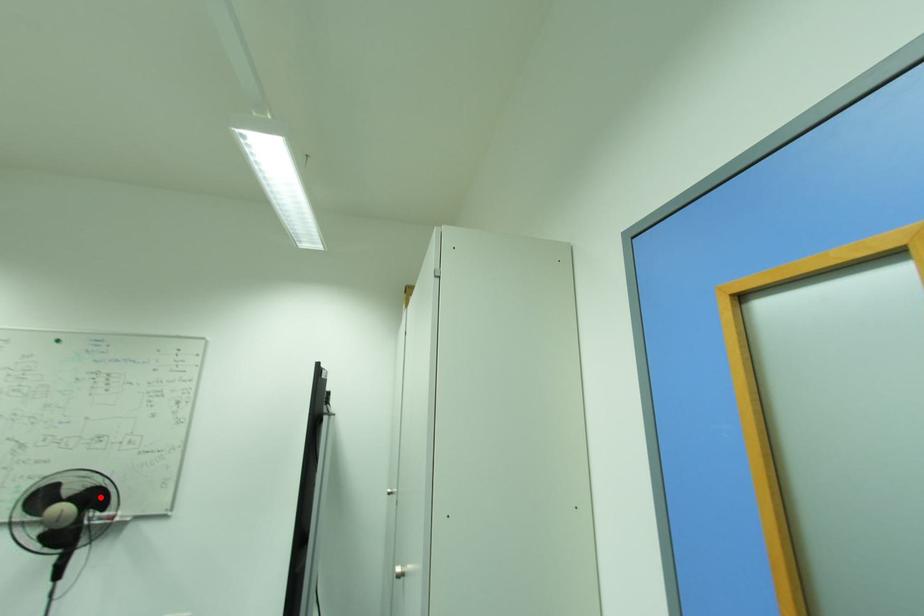
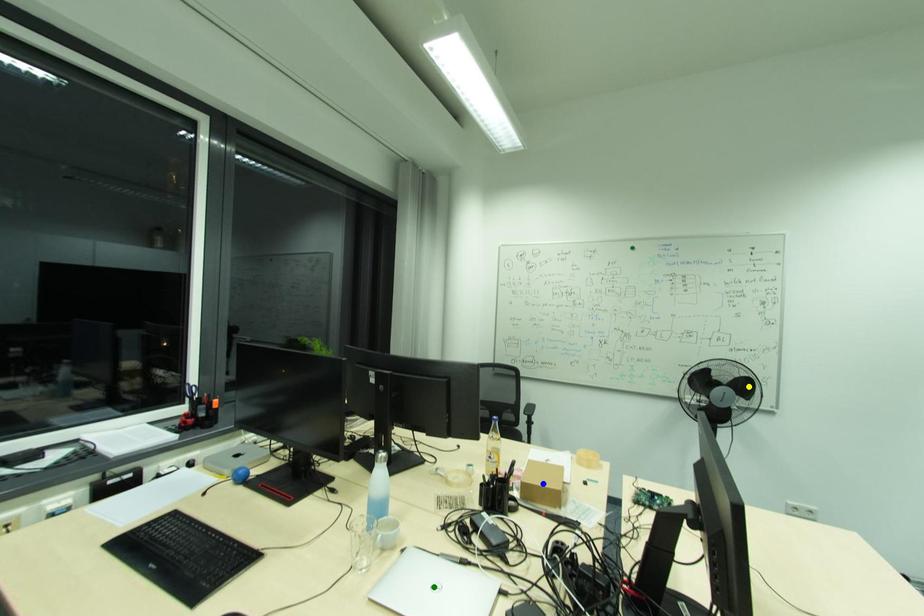
Question: I am providing you with two images of the same scene from different viewpoints. A red point is marked on the first image. You are given multiple points on the second image. Can you choose the point in image 2 that corresponds to the point in image 1?

Choices:
 (A) green point
 (B) yellow point
 (C) blue point

Answer: (B)